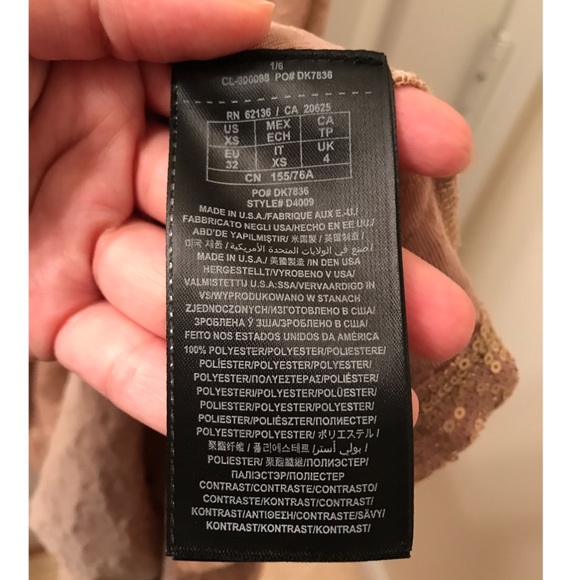
This screenshot has width=580, height=580. In order to click on white blurry wall in this screenshot , I will do `click(435, 39)`.